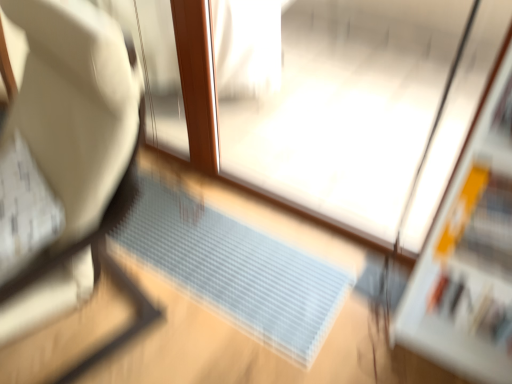
At what (x,y) coordinates should I click in order to perform the action: click on vacant location below translucent plastic doormat at center (from a real-world perspective). Please return your answer as a coordinate pair (x, y). Looking at the image, I should click on (218, 251).